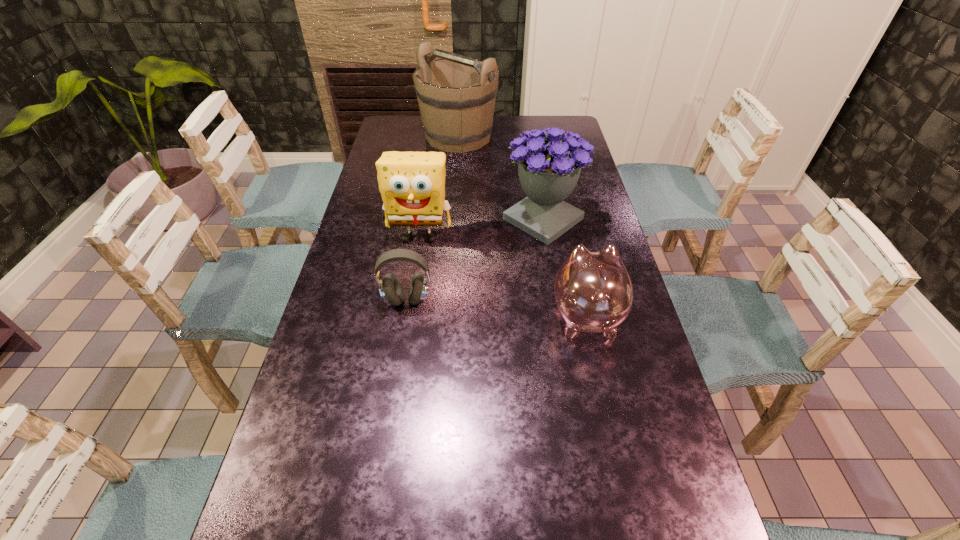
Identify the location of free location at the right edge. The image size is (960, 540). (662, 428).

At what (x,y) coordinates should I click in order to perform the action: click on vacant area that lies between the headset and the third tallest object. Please return your answer as a coordinate pair (x, y). This screenshot has width=960, height=540. Looking at the image, I should click on (413, 268).

You are a GUI agent. You are given a task and a screenshot of the screen. Output one action in this format:
    pyautogui.click(x=<x>, y=<y>)
    Task: Click on the vacant area between the bouquet and the headset
    
    Given the screenshot: What is the action you would take?
    pyautogui.click(x=475, y=260)

This screenshot has width=960, height=540. I want to click on unoccupied area between the bouquet and the bucket, so click(501, 178).

Locate an element on the screen. Image resolution: width=960 pixels, height=540 pixels. free space between the third shortest object and the bouquet is located at coordinates pyautogui.click(x=482, y=228).

Find the location of `free space between the farthest object and the bouquet`. free space between the farthest object and the bouquet is located at coordinates (501, 178).

Find the location of `object that can be found as the fourth closest to the headset`. object that can be found as the fourth closest to the headset is located at coordinates (456, 94).

You are a GUI agent. You are given a task and a screenshot of the screen. Output one action in this format:
    pyautogui.click(x=<x>, y=<y>)
    Task: Click on the object identified as the second closest to the farthest object
    The height and width of the screenshot is (540, 960).
    Given the screenshot: What is the action you would take?
    pyautogui.click(x=412, y=184)

Identify the location of vacant area in the image that satisfies the following two spatial constraints: 1. on the front side of the bouquet; 2. on the right side of the farthest object. (452, 219).